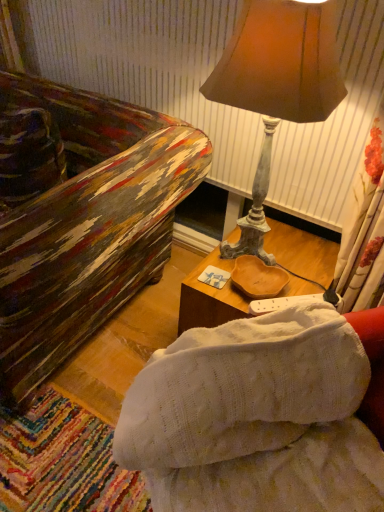
What do you see at coordinates (210, 298) in the screenshot? This screenshot has height=512, width=384. I see `wooden tray at center` at bounding box center [210, 298].

At what (x,y) coordinates should I click in order to perform the action: click on wooden tray at center. Please return your answer as a coordinate pair (x, y). The image size is (384, 512). Looking at the image, I should click on (210, 298).

From the picture: Between wooden tray at center and white knitted studio couch at center, which one has larger size?

white knitted studio couch at center.

From a real-world perspective, which is physically above, wooden tray at center or white knitted studio couch at center?

white knitted studio couch at center, from a real-world perspective.

Which object is positioned more to the right, wooden tray at center or white knitted studio couch at center?

wooden tray at center.

From the image's perspective, is white knitted studio couch at center above wooden tray at center?

No, from the image's perspective, white knitted studio couch at center is not over wooden tray at center.

Is white knitted studio couch at center at the right side of wooden tray at center?

No, white knitted studio couch at center is not to the right of wooden tray at center.

Do you think white knitted studio couch at center is within wooden tray at center, or outside of it?

white knitted studio couch at center is not enclosed by wooden tray at center.

Can you confirm if white knitted studio couch at center is shorter than wooden tray at center?

No.

Do you think white knitted studio couch at center is within matte brown lampshade at upper right, or outside of it?

white knitted studio couch at center is spatially situated outside matte brown lampshade at upper right.

Which object is positioned more to the right, white knitted studio couch at center or matte brown lampshade at upper right?

Positioned to the right is matte brown lampshade at upper right.

From the picture: Is white knitted studio couch at center aimed at matte brown lampshade at upper right?

No, white knitted studio couch at center is not turned towards matte brown lampshade at upper right.

From the picture: From the image's perspective, between matte brown lampshade at upper right and white knitted studio couch at center, who is located below?

white knitted studio couch at center is shown below in the image.

Considering the sizes of objects matte brown lampshade at upper right and white knitted studio couch at center in the image provided, who is smaller, matte brown lampshade at upper right or white knitted studio couch at center?

With smaller size is matte brown lampshade at upper right.

Is matte brown lampshade at upper right positioned beyond the bounds of white knitted studio couch at center?

matte brown lampshade at upper right is positioned outside white knitted studio couch at center.

Can you confirm if matte brown lampshade at upper right is taller than white knitted studio couch at center?

Yes, matte brown lampshade at upper right is taller than white knitted studio couch at center.

From a real-world perspective, between wooden tray at center and matte brown lampshade at upper right, who is vertically lower?

wooden tray at center, from a real-world perspective.

Considering the sizes of objects wooden tray at center and matte brown lampshade at upper right in the image provided, who is taller, wooden tray at center or matte brown lampshade at upper right?

Standing taller between the two is matte brown lampshade at upper right.

Could you tell me if wooden tray at center is facing matte brown lampshade at upper right?

No.

Which object is further away from the camera, matte brown lampshade at upper right or wooden tray at center?

Positioned behind is wooden tray at center.

From the image's perspective, is matte brown lampshade at upper right below wooden tray at center?

Actually, matte brown lampshade at upper right appears above wooden tray at center in the image.

Is point (241, 49) closer or farther from the camera than point (233, 308)?

Point (241, 49).

Is wooden tray at center a part of matte brown lampshade at upper right?

Definitely not — wooden tray at center is not inside matte brown lampshade at upper right.

In order to click on studio couch located on the left of wooden tray at center in this screenshot , I will do `click(255, 418)`.

Locate an element on the screen. Image resolution: width=384 pixels, height=512 pixels. table that appears behind the white knitted studio couch at center is located at coordinates (210, 298).

Based on their spatial positions, is matte brown lampshade at upper right or wooden tray at center further from white knitted studio couch at center?

matte brown lampshade at upper right.

Looking at the image, which one is located further to matte brown lampshade at upper right, white knitted studio couch at center or wooden tray at center?

white knitted studio couch at center.

Looking at the image, which one is located closer to wooden tray at center, white knitted studio couch at center or matte brown lampshade at upper right?

white knitted studio couch at center is positioned closer to the anchor wooden tray at center.

Which object lies nearer to the anchor point white knitted studio couch at center, wooden tray at center or matte brown lampshade at upper right?

wooden tray at center is positioned closer to the anchor white knitted studio couch at center.

When comparing their distances from matte brown lampshade at upper right, does wooden tray at center or white knitted studio couch at center seem further?

white knitted studio couch at center lies further to matte brown lampshade at upper right than the other object.

When comparing their distances from wooden tray at center, does matte brown lampshade at upper right or white knitted studio couch at center seem closer?

white knitted studio couch at center lies closer to wooden tray at center than the other object.

Where is `lamp between white knitted studio couch at center and wooden tray at center along the z-axis`? lamp between white knitted studio couch at center and wooden tray at center along the z-axis is located at coordinates (276, 86).